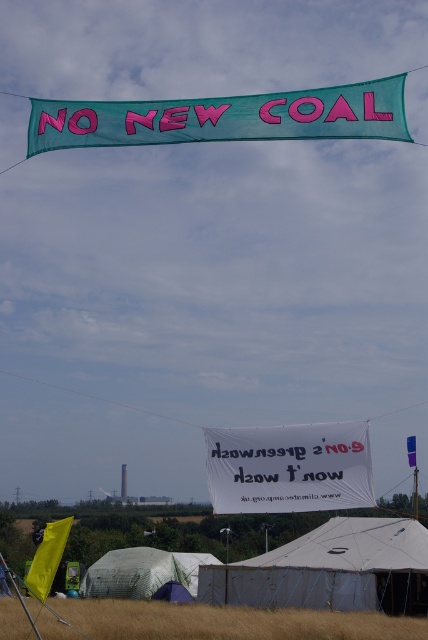
Measure the distance from teal fabric banner at upper center to brown grass at lower center.

The distance of teal fabric banner at upper center from brown grass at lower center is 30.98 meters.

This screenshot has height=640, width=428. I want to click on teal fabric banner at upper center, so click(223, 116).

Identify the location of teal fabric banner at upper center. (223, 116).

Is teal fabric banner at upper center smaller than white fabric banner at center?

Incorrect, teal fabric banner at upper center is not smaller in size than white fabric banner at center.

Who is lower down, teal fabric banner at upper center or white fabric banner at center?

Positioned lower is white fabric banner at center.

Identify the location of teal fabric banner at upper center. This screenshot has height=640, width=428. (223, 116).

Between point (213, 429) and point (152, 586), which one is positioned in front?

Point (213, 429)

Can you confirm if white fabric banner at center is positioned below transparent plastic tent at lower center?

Incorrect, white fabric banner at center is not positioned below transparent plastic tent at lower center.

Between point (348, 436) and point (214, 557), which one is positioned behind?

The point (214, 557) is more distant.

Locate an element on the screen. The image size is (428, 640). white fabric banner at center is located at coordinates (288, 467).